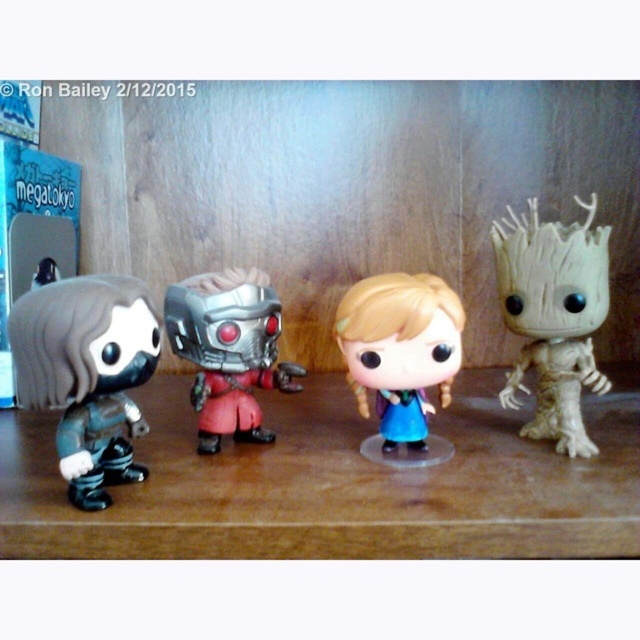
Does blonde hair plastic doll at center appear on the right side of metallic silver robot at center?

Yes, blonde hair plastic doll at center is to the right of metallic silver robot at center.

Which of these two, blonde hair plastic doll at center or metallic silver robot at center, stands taller?

metallic silver robot at center

The height and width of the screenshot is (640, 640). Identify the location of blonde hair plastic doll at center. tap(401, 349).

Is white textured tree-like figure at right smaller than metallic silver robot at center?

Yes, white textured tree-like figure at right is smaller than metallic silver robot at center.

Based on the photo, between white textured tree-like figure at right and metallic silver robot at center, which one is positioned higher?

white textured tree-like figure at right

At what (x,y) coordinates should I click in order to perform the action: click on white textured tree-like figure at right. Please return your answer as a coordinate pair (x, y). The height and width of the screenshot is (640, 640). Looking at the image, I should click on (554, 316).

Can you confirm if white textured tree-like figure at right is wider than blonde hair plastic doll at center?

In fact, white textured tree-like figure at right might be narrower than blonde hair plastic doll at center.

Is point (556, 360) less distant than point (436, 323)?

No, it is not.

Where is `white textured tree-like figure at right`? Image resolution: width=640 pixels, height=640 pixels. white textured tree-like figure at right is located at coordinates (554, 316).